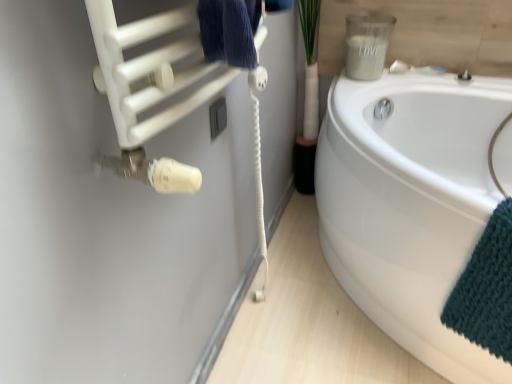
Question: Do you think white glossy bathtub at lower right is within teal knitted towel at lower right, or outside of it?

Choices:
 (A) inside
 (B) outside

Answer: (B)

Question: Considering the relative positions of white glossy bathtub at lower right and teal knitted towel at lower right in the image provided, is white glossy bathtub at lower right to the left or to the right of teal knitted towel at lower right?

Choices:
 (A) left
 (B) right

Answer: (A)

Question: Which of these objects is positioned farthest from the white matte towel at upper left?

Choices:
 (A) satin nickel faucet at upper right
 (B) white glossy bathtub at lower right
 (C) teal knitted towel at lower right

Answer: (A)

Question: Which object is positioned farthest from the white matte towel at upper left?

Choices:
 (A) satin nickel faucet at upper right
 (B) teal knitted towel at lower right
 (C) white glossy bathtub at lower right

Answer: (A)